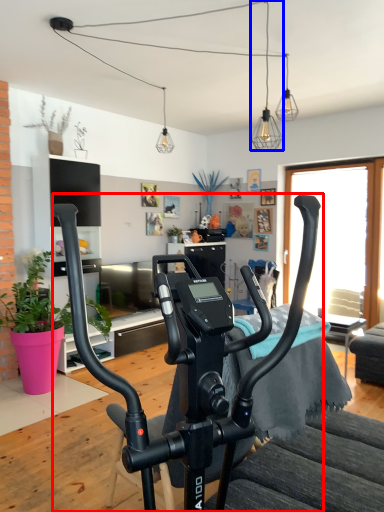
Question: Which object appears closest to the camera in this image, stationary bicycle (highlighted by a red box) or light fixture (highlighted by a blue box)?

Choices:
 (A) stationary bicycle
 (B) light fixture

Answer: (A)